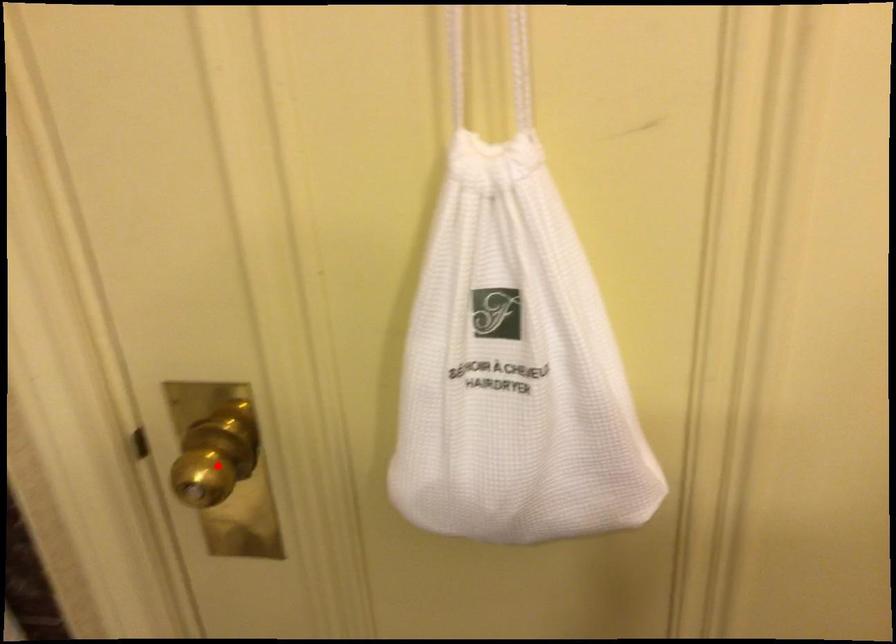
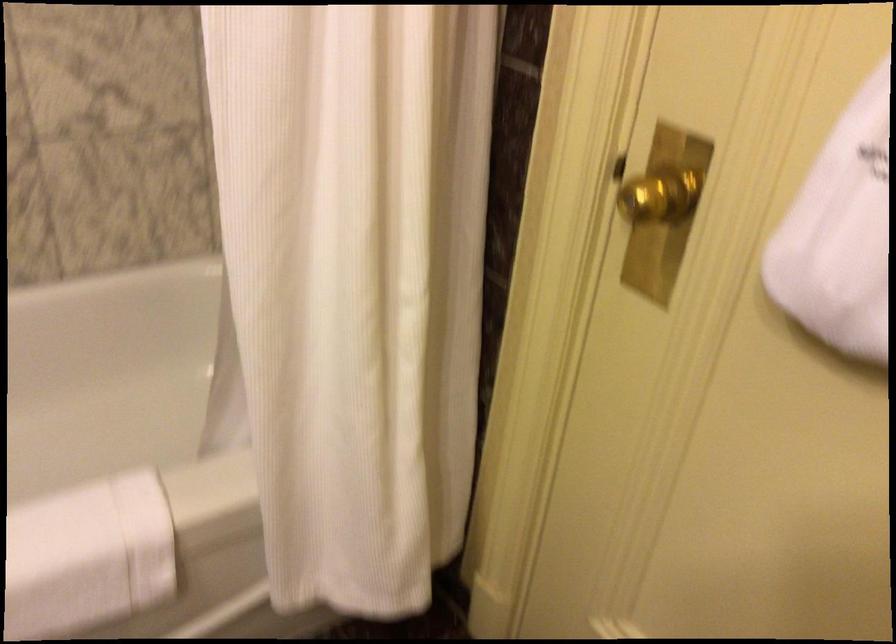
Question: A red point is marked in image1. In image2, is the corresponding 3D point closer to the camera or farther? Reply with the corresponding letter.

Choices:
 (A) The corresponding 3D point is closer.
 (B) The corresponding 3D point is farther.

Answer: (B)